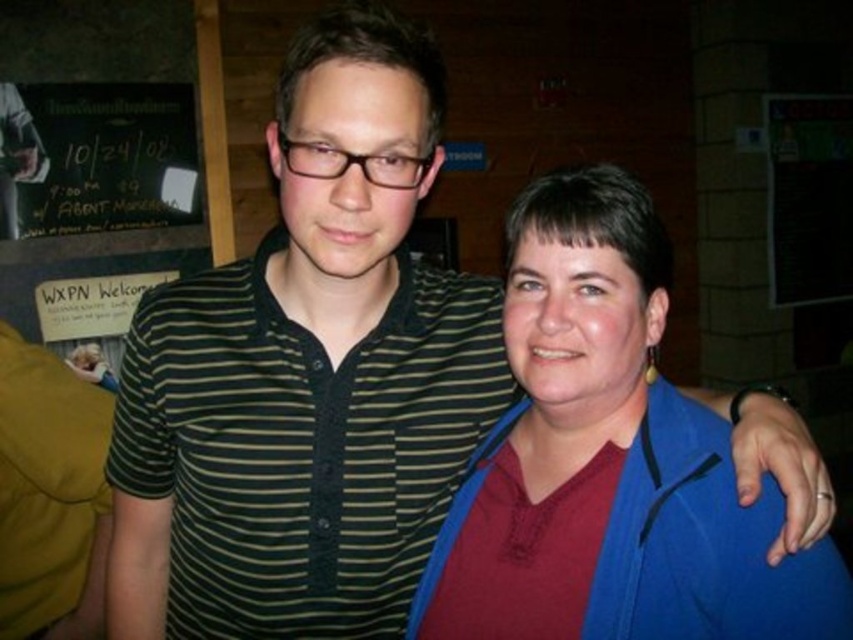
Is maroon fabric shirt at center smaller than black chalkboard at upper left?

Correct, maroon fabric shirt at center occupies less space than black chalkboard at upper left.

Is maroon fabric shirt at center shorter than black chalkboard at upper left?

Correct, maroon fabric shirt at center is not as tall as black chalkboard at upper left.

What do you see at coordinates (608, 461) in the screenshot? I see `maroon fabric shirt at center` at bounding box center [608, 461].

Locate an element on the screen. maroon fabric shirt at center is located at coordinates (608, 461).